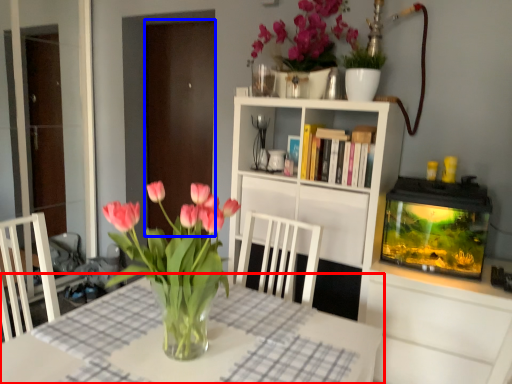
Question: Which of the following is the closest to the observer, table (highlighted by a red box) or glass door (highlighted by a blue box)?

Choices:
 (A) table
 (B) glass door

Answer: (A)